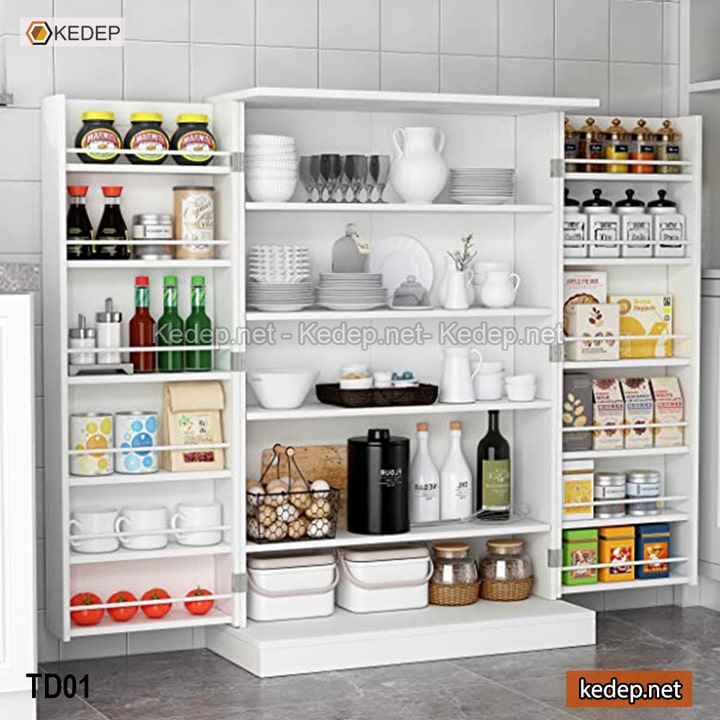
Locate an element on the screen. jars is located at coordinates (94, 135), (145, 140), (199, 135), (81, 342), (109, 337).